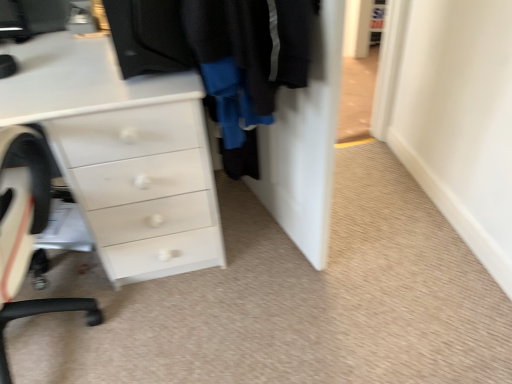
Question: Considering the relative positions of white glossy chest of drawers at center and black fabric door at center in the image provided, is white glossy chest of drawers at center to the left or to the right of black fabric door at center?

Choices:
 (A) left
 (B) right

Answer: (A)

Question: Based on their sizes in the image, would you say white glossy chest of drawers at center is bigger or smaller than black fabric door at center?

Choices:
 (A) big
 (B) small

Answer: (A)

Question: Estimate the real-world distances between objects in this image. Which object is farther from the black fabric door at center?

Choices:
 (A) white glossy chest of drawers at center
 (B) white plastic chair at left

Answer: (B)

Question: Considering the real-world distances, which object is closest to the white plastic chair at left?

Choices:
 (A) white glossy chest of drawers at center
 (B) black fabric door at center

Answer: (A)